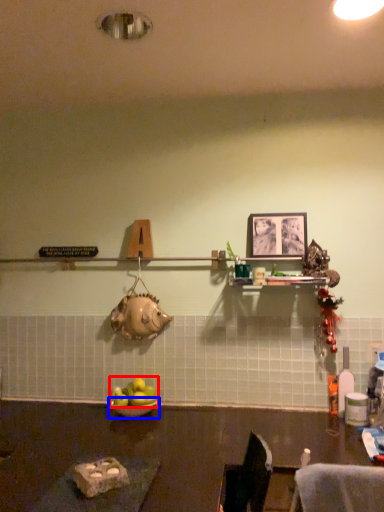
Question: Which point is further to the camera, apple (highlighted by a red box) or bowl (highlighted by a blue box)?

Choices:
 (A) apple
 (B) bowl

Answer: (A)